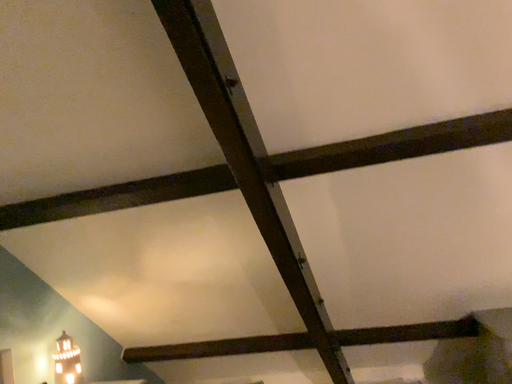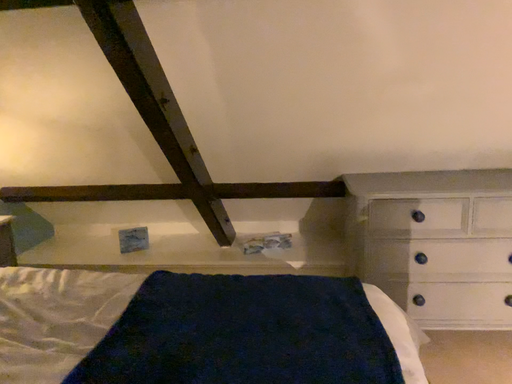
Question: How did the camera likely rotate when shooting the video?

Choices:
 (A) rotated upward
 (B) rotated downward

Answer: (B)